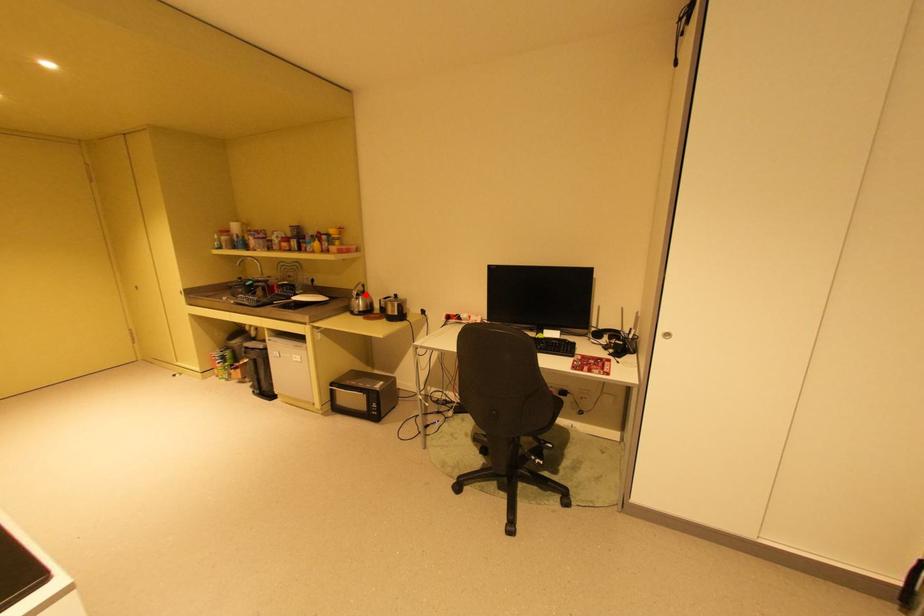
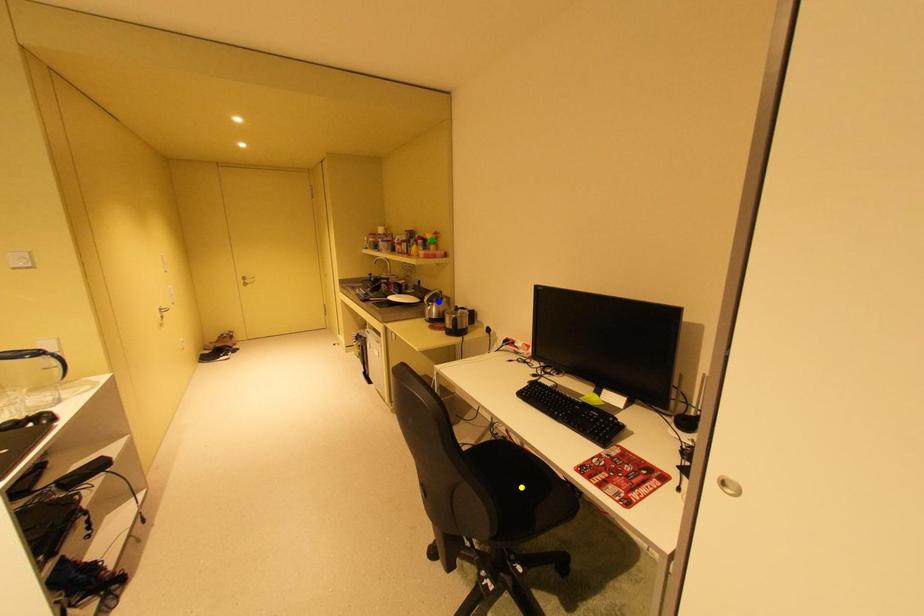
Question: I am providing you with two images of the same scene from different viewpoints. A red point is marked on the first image. You are given multiple points on the second image. Which point in image 2 represents the same 3d spot as the red point in image 1?

Choices:
 (A) blue point
 (B) yellow point
 (C) green point

Answer: (A)